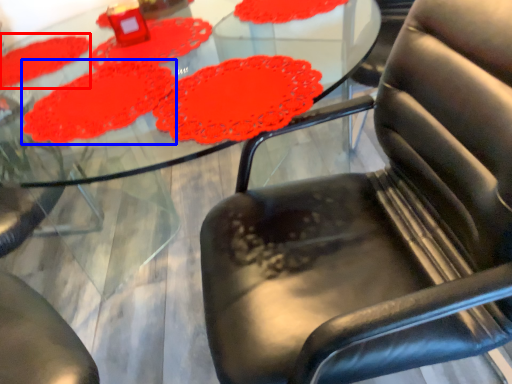
Question: Which point is closer to the camera, mat (highlighted by a red box) or mat (highlighted by a blue box)?

Choices:
 (A) mat
 (B) mat

Answer: (B)